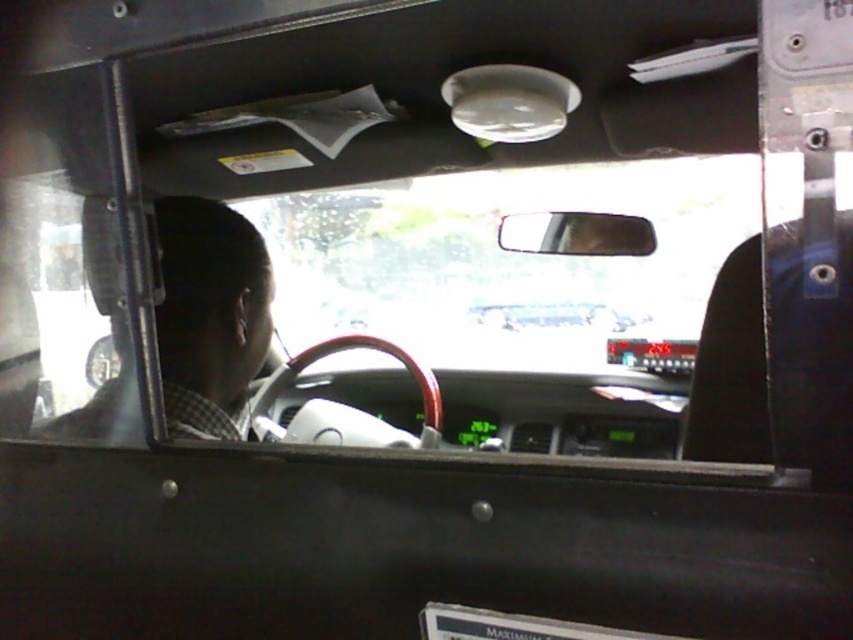
Who is lower down, dark gray checkered shirt at left or white plastic license plate at center?

white plastic license plate at center is below.

Can you confirm if dark gray checkered shirt at left is positioned to the left of white plastic license plate at center?

Indeed, dark gray checkered shirt at left is positioned on the left side of white plastic license plate at center.

Is point (196, 314) closer to viewer compared to point (608, 637)?

No.

At what (x,y) coordinates should I click in order to perform the action: click on dark gray checkered shirt at left. Please return your answer as a coordinate pair (x, y). The image size is (853, 640). Looking at the image, I should click on (209, 314).